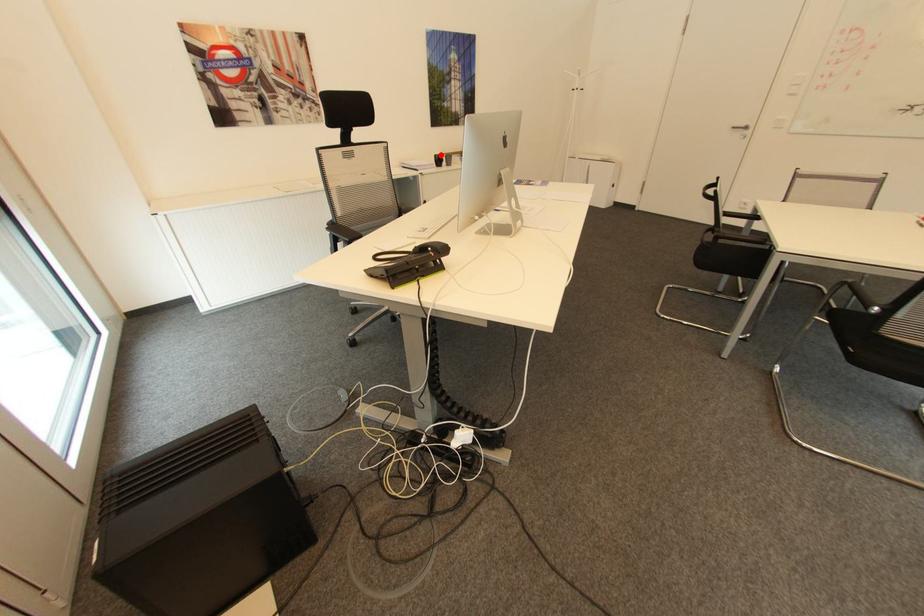
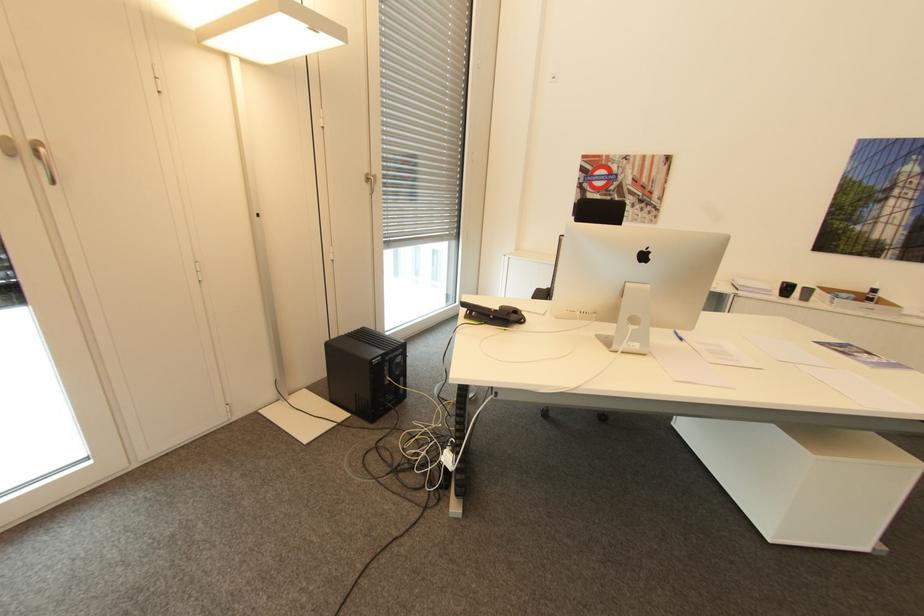
Question: I am providing you with two images of the same scene from different viewpoints. Image1 has a red point marked. In image2, the corresponding 3D location appears at what relative position? Reply with the corresponding letter.

Choices:
 (A) Closer
 (B) Farther

Answer: (B)